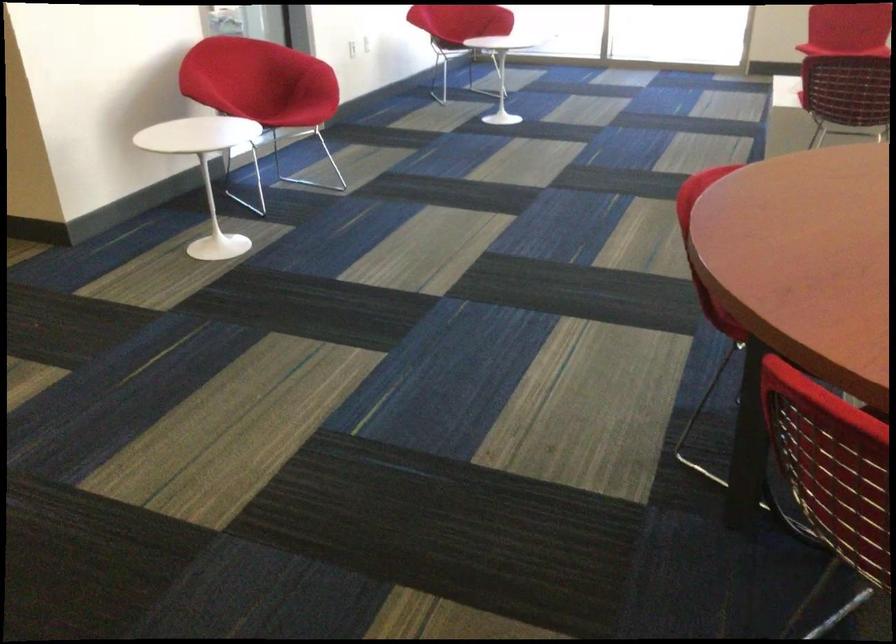
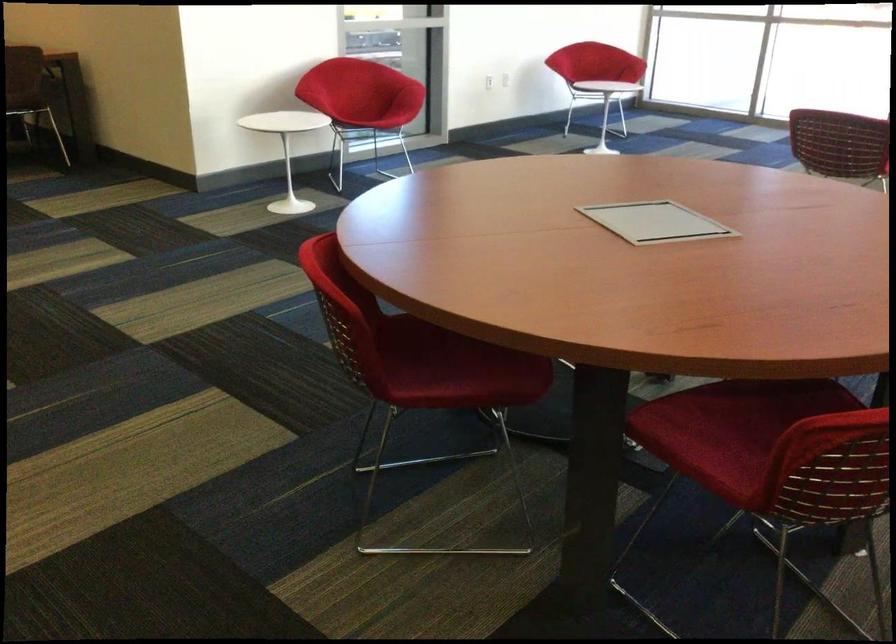
In the second image, find the point that corresponds to point 262,100 in the first image.

(363, 104)